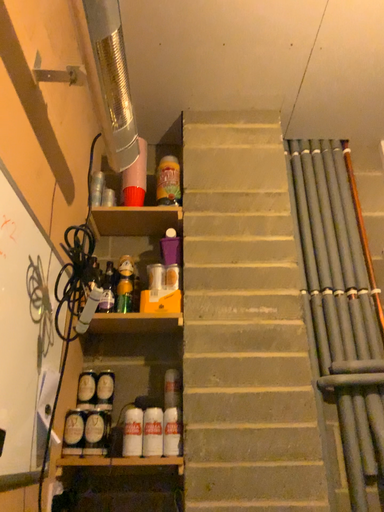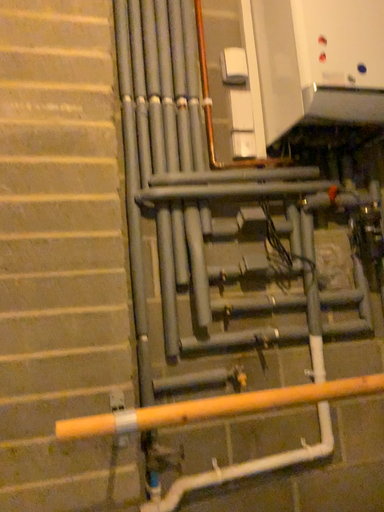
Question: Which way did the camera rotate in the video?

Choices:
 (A) rotated right
 (B) rotated left

Answer: (A)